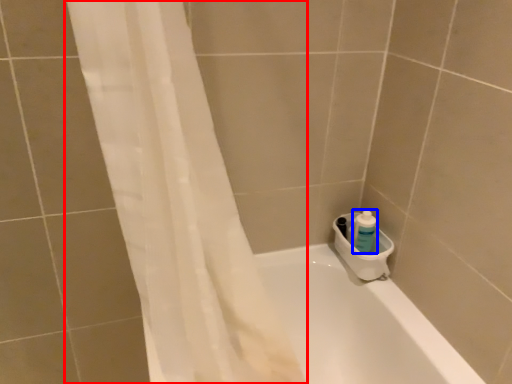
Question: Which point is further to the camera, shower curtain (highlighted by a red box) or cleaning product (highlighted by a blue box)?

Choices:
 (A) shower curtain
 (B) cleaning product

Answer: (B)